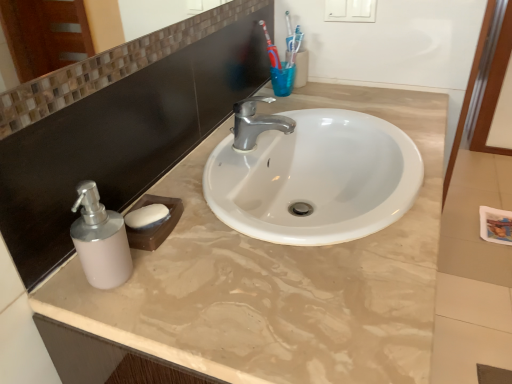
The height and width of the screenshot is (384, 512). Describe the element at coordinates (274, 279) in the screenshot. I see `beige marble counter at center` at that location.

Locate an element on the screen. Image resolution: width=512 pixels, height=384 pixels. beige marble counter at center is located at coordinates (x=274, y=279).

The width and height of the screenshot is (512, 384). In order to click on beige marble counter at center in this screenshot , I will do `click(274, 279)`.